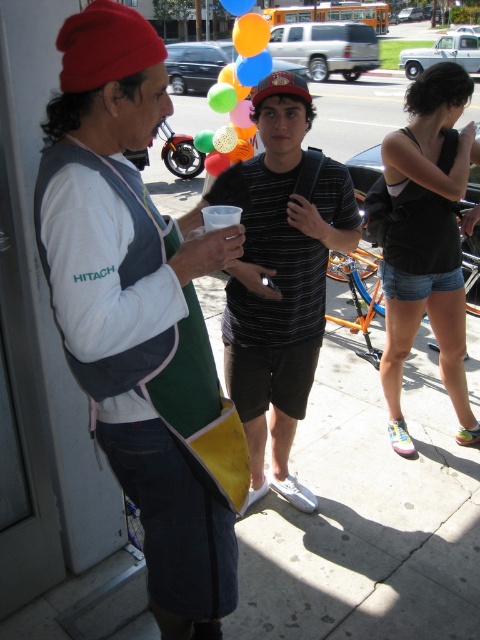
You are a photographer standing at the scene. You want to take a photo of the matte white shirt at left and the rubber balloon at upper center in the same frame. What is the minimum distance you need to move backward to ensure both objects are in the frame?

The minimum distance you need to move backward is 4.89 meters to ensure both the matte white shirt at left and the rubber balloon at upper center are in the frame since they are 4.89 meters apart.

Based on the photo, you are a photographer trying to capture a candid shot of the denim shorts at center and the rubber balloon at upper center. Which object should you focus on first if you want to include both in your frame without moving the camera?

The denim shorts at center is positioned on the right side of rubber balloon at upper center, so you should focus on the rubber balloon at upper center first to ensure both are in frame without moving the camera.